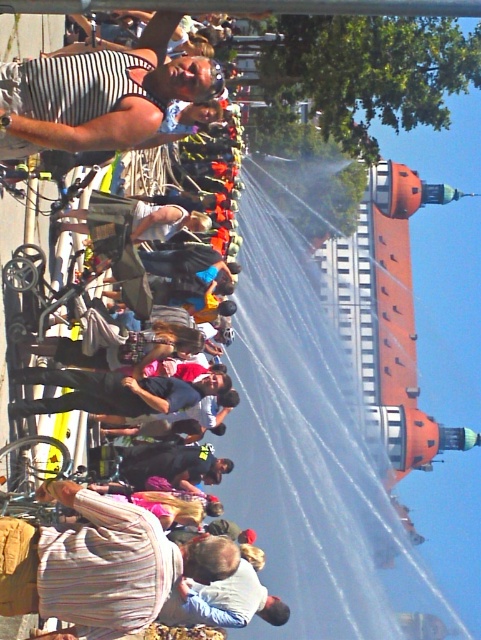
Does striped fabric shirt at lower left appear under striped fabric tank top at upper left?

Correct, striped fabric shirt at lower left is located below striped fabric tank top at upper left.

Where is `striped fabric shirt at lower left`? striped fabric shirt at lower left is located at coordinates (101, 564).